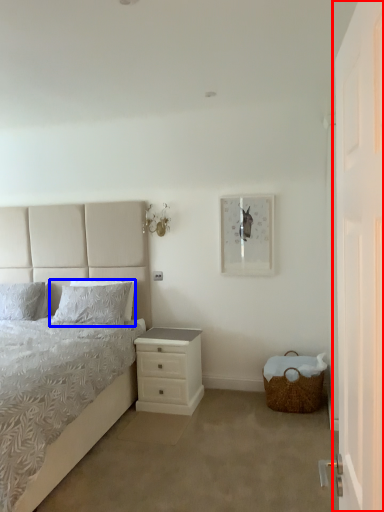
Question: Which object is further to the camera taking this photo, door (highlighted by a red box) or pillow (highlighted by a blue box)?

Choices:
 (A) door
 (B) pillow

Answer: (B)